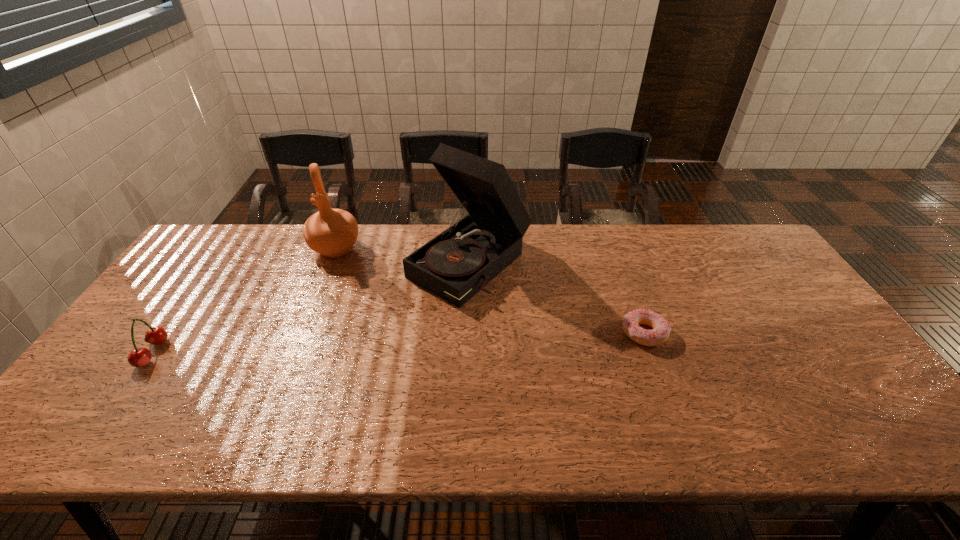
Identify the location of vacant space located 0.220m on the front-facing side of the tallest object. The width and height of the screenshot is (960, 540). [x=370, y=344].

Where is `free space located on the front-facing side of the tallest object`? Image resolution: width=960 pixels, height=540 pixels. free space located on the front-facing side of the tallest object is located at coordinates (408, 314).

Identify the location of vacant space situated 0.380m on the front-facing side of the tallest object. The height and width of the screenshot is (540, 960). (320, 384).

Image resolution: width=960 pixels, height=540 pixels. In order to click on blank space located 0.180m on the spout of the second tallest object in this screenshot , I will do `click(336, 303)`.

In order to click on free spot located 0.310m on the spout of the second tallest object in this screenshot , I will do click(x=336, y=336).

Locate an element on the screen. This screenshot has width=960, height=540. vacant region located 0.340m on the spout of the second tallest object is located at coordinates (336, 344).

The image size is (960, 540). Find the location of `phonograph_record that is at the far edge`. phonograph_record that is at the far edge is located at coordinates (455, 265).

Locate an element on the screen. This screenshot has width=960, height=540. pottery that is positioned at the far edge is located at coordinates [x=331, y=232].

You are a GUI agent. You are given a task and a screenshot of the screen. Output one action in this format:
    pyautogui.click(x=<x>, y=<y>)
    Task: Click on the object that is positioned at the left edge
    
    Given the screenshot: What is the action you would take?
    pyautogui.click(x=139, y=357)

In the image, there is a desktop. Where is `vacant space at the far edge`? The height and width of the screenshot is (540, 960). vacant space at the far edge is located at coordinates (606, 237).